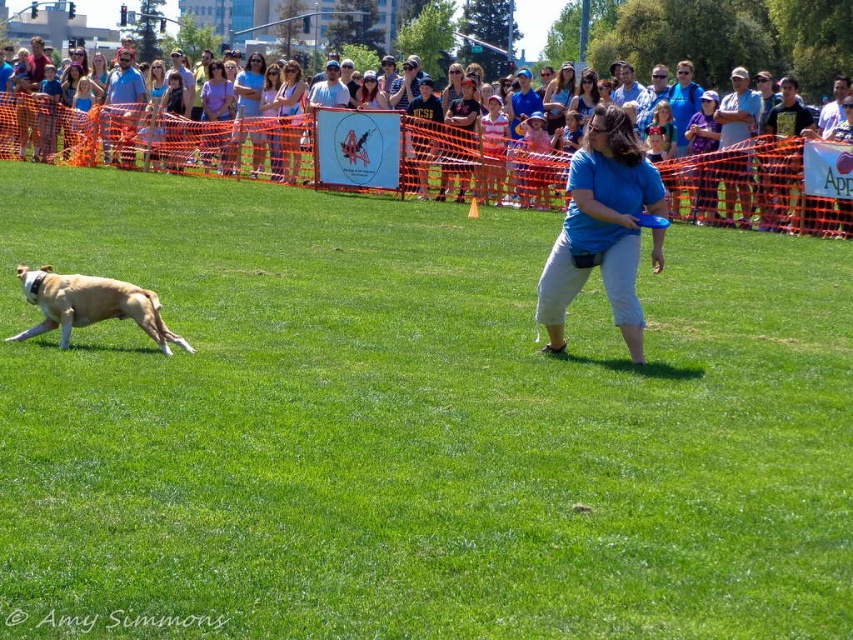
Question: Does purple cotton shirt at center lie in front of light brown hair at upper center?

Choices:
 (A) no
 (B) yes

Answer: (A)

Question: Observing the image, what is the correct spatial positioning of light blue shirt at upper center in reference to matte blue shirt at center?

Choices:
 (A) left
 (B) right

Answer: (B)

Question: Which point appears farthest from the camera in this image?

Choices:
 (A) (834, 198)
 (B) (206, 148)
 (C) (737, 104)

Answer: (B)

Question: Among these points, which one is farthest from the camera?

Choices:
 (A) (157, 317)
 (B) (263, 96)
 (C) (718, 124)
 (D) (202, 83)

Answer: (D)

Question: Which point is closer to the camera taking this photo?

Choices:
 (A) (299, 168)
 (B) (16, 336)

Answer: (B)

Question: Does light blue shirt at center appear under purple cotton shirt at center?

Choices:
 (A) yes
 (B) no

Answer: (B)